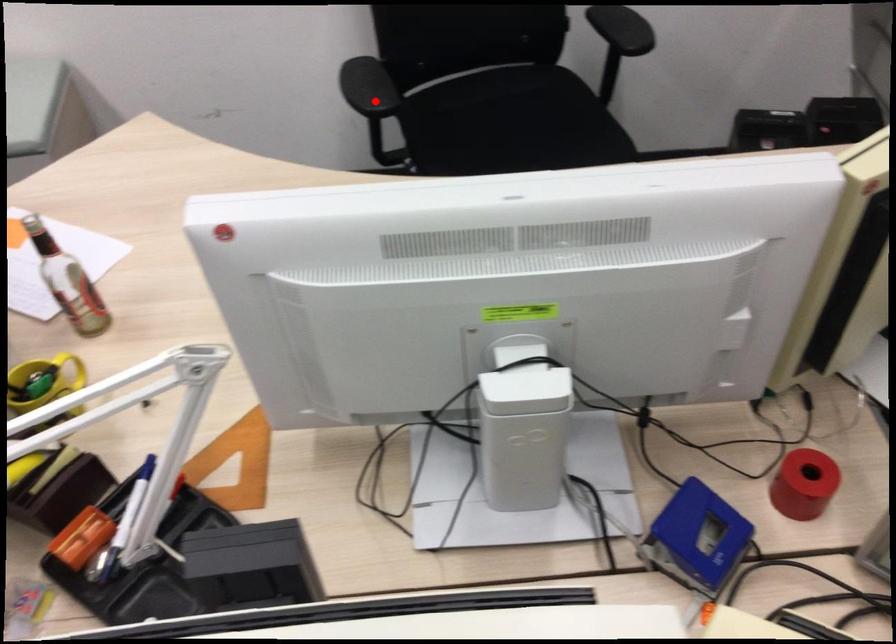
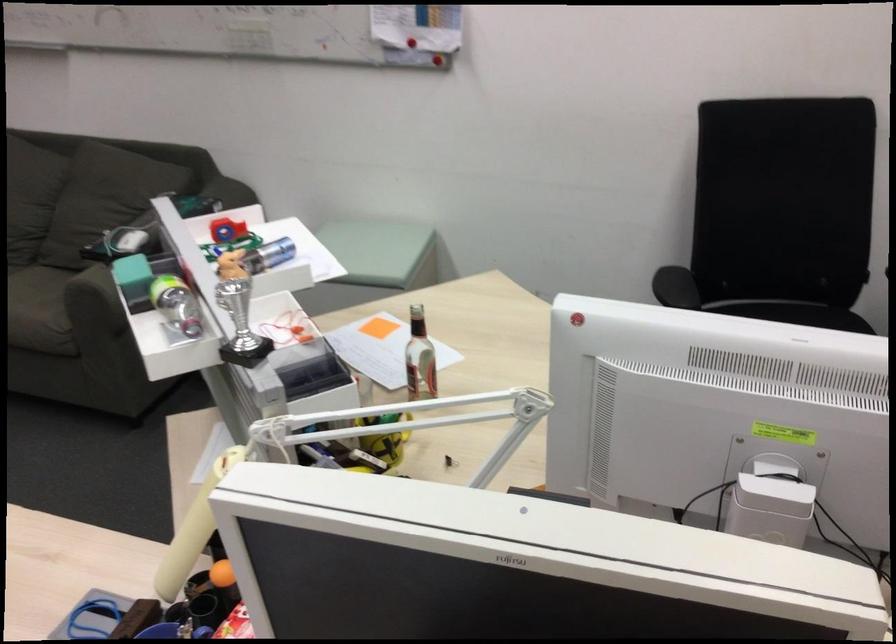
Question: I am providing you with two images of the same scene from different viewpoints. Image1 has a red point marked. In image2, the corresponding 3D location appears at what relative position? Reply with the corresponding letter.

Choices:
 (A) Closer
 (B) Farther

Answer: (B)